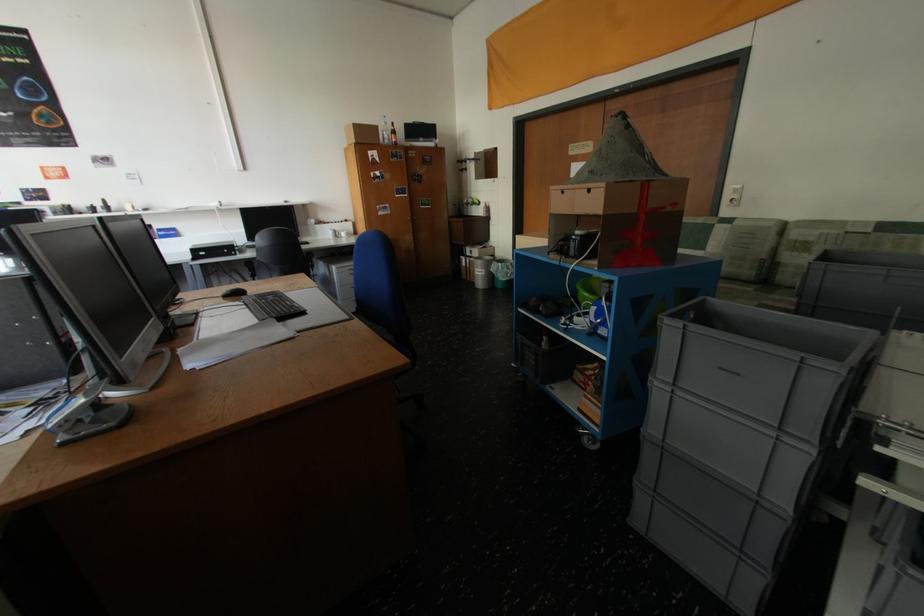
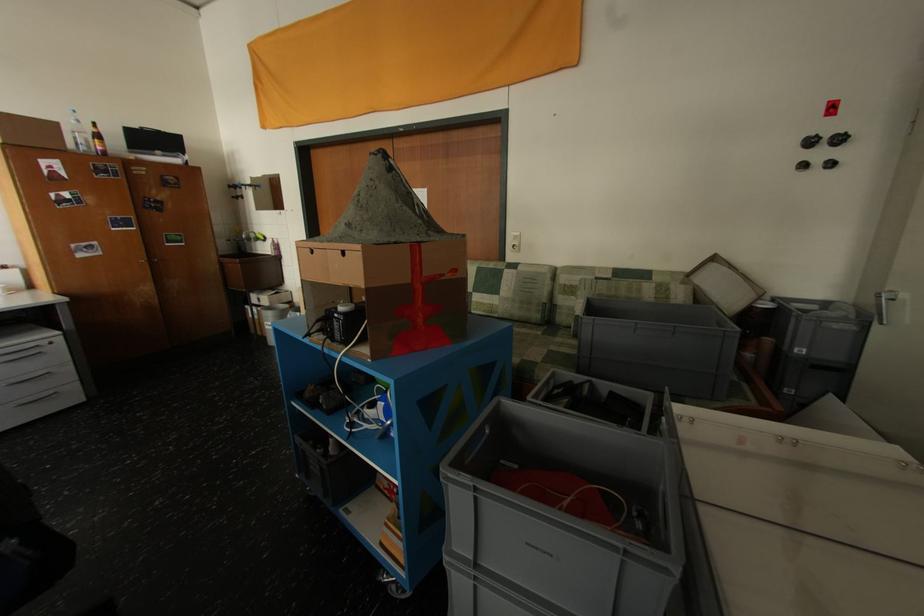
Where in the second image is the point corresponding to (x=397, y=138) from the first image?

(95, 142)